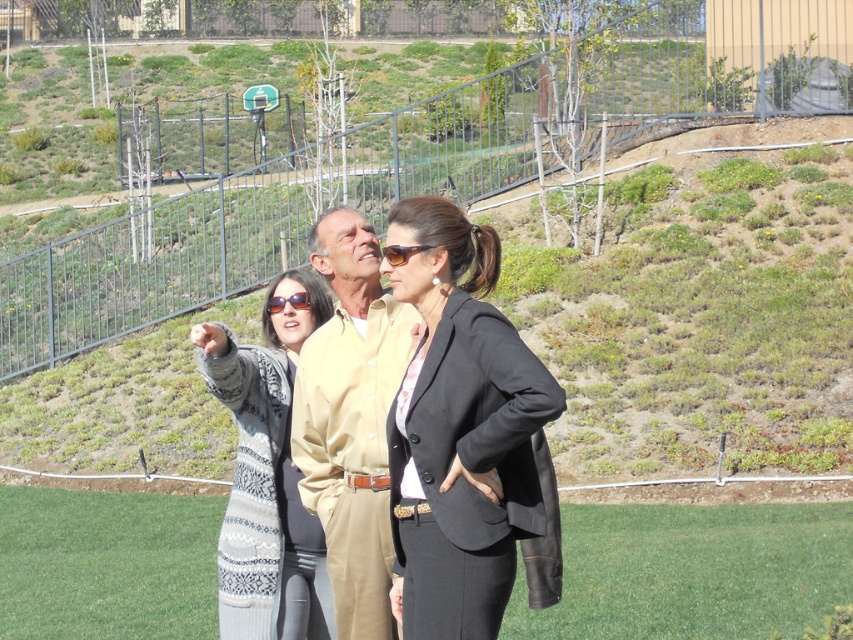
You are a photographer trying to capture the matte black sunglasses at center in your shot. Based on their position, which direction should you move relative to the current camera position to ensure they are centered in the frame?

The matte black sunglasses at center are already positioned at the center coordinates of the image, so no movement is needed. The sunglasses are already centered in the frame.

Based on the scene description, what does the point at coordinates [700,310] represent?

The point at coordinates [700,310] indicates green grass at center.